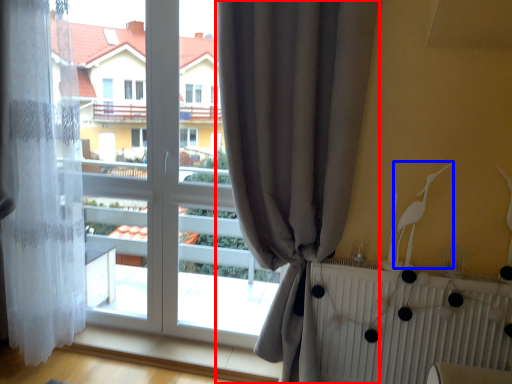
Question: Among these objects, which one is farthest to the camera, curtain (highlighted by a red box) or bird (highlighted by a blue box)?

Choices:
 (A) curtain
 (B) bird

Answer: (B)